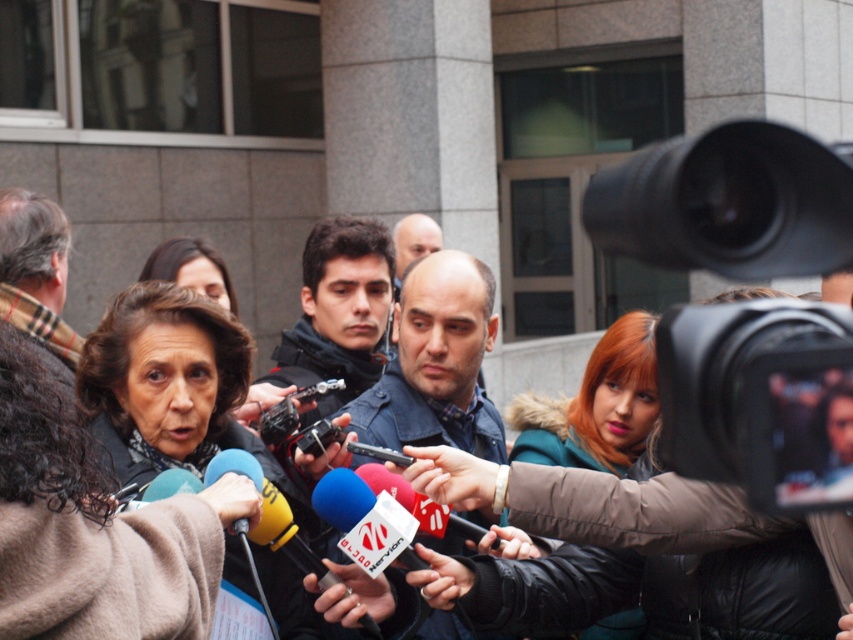
This screenshot has width=853, height=640. What do you see at coordinates (173, 387) in the screenshot?
I see `dark brown hair at center` at bounding box center [173, 387].

Is point (299, 586) farther from camera compared to point (419, 237)?

No, it is in front of (419, 237).

Does point (137, 440) lie behind point (428, 225)?

No, (137, 440) is in front of (428, 225).

Image resolution: width=853 pixels, height=640 pixels. I want to click on dark brown hair at center, so click(173, 387).

Can you confirm if matte brown scarf at center is taller than smooth bald head at center?

Correct, matte brown scarf at center is much taller as smooth bald head at center.

Does point (80, 579) come farther from viewer compared to point (399, 275)?

That is False.

Locate an element on the screen. The image size is (853, 640). matte brown scarf at center is located at coordinates (93, 525).

Who is positioned more to the right, dark blue jacket at center or shiny teal jacket at center?

From the viewer's perspective, shiny teal jacket at center appears more on the right side.

Is dark blue jacket at center shorter than shiny teal jacket at center?

Incorrect, dark blue jacket at center's height does not fall short of shiny teal jacket at center's.

Is point (315, 364) farther from camera compared to point (605, 348)?

Yes, it is behind point (605, 348).

I want to click on dark blue jacket at center, so click(x=338, y=310).